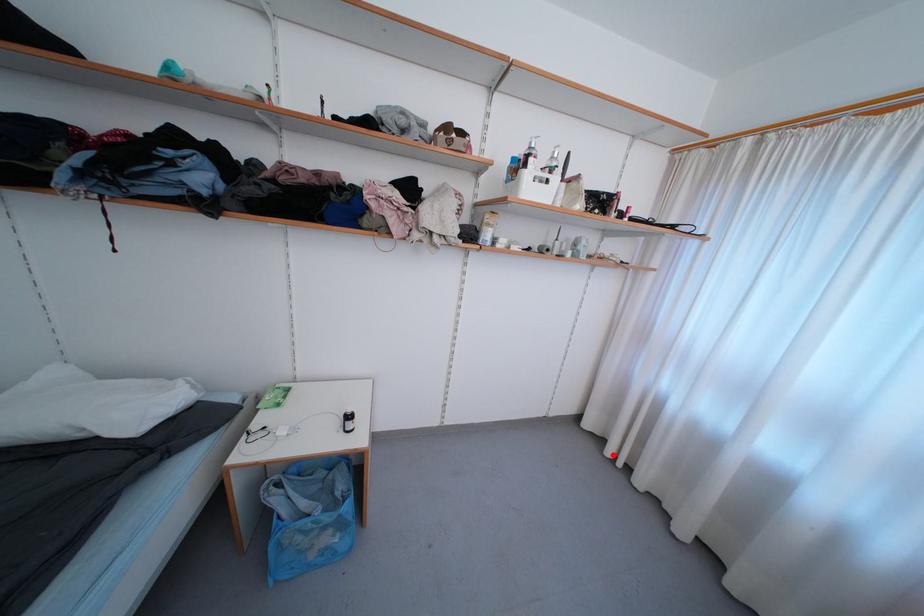
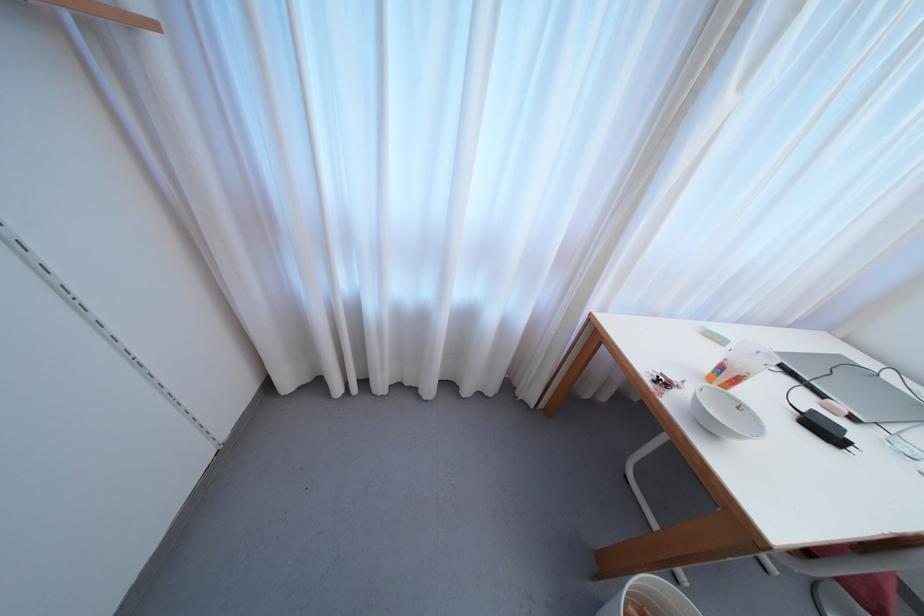
Find the pixel in the second image that matches the highlighted location in the first image.

(342, 392)